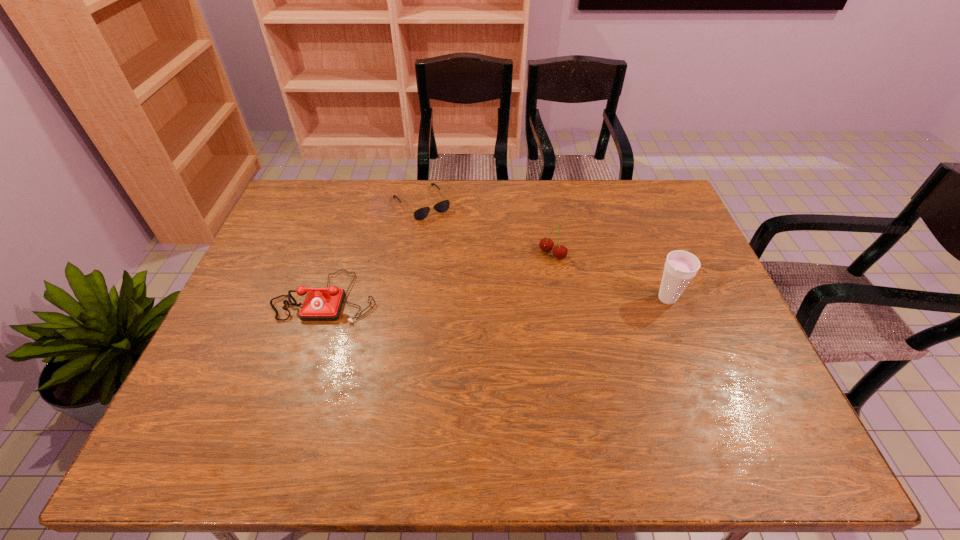
Image resolution: width=960 pixels, height=540 pixels. Identify the location of vacant region located 0.140m on the front-facing side of the shortest object. (456, 244).

The height and width of the screenshot is (540, 960). Identify the location of vacant space located 0.270m on the front-facing side of the shortest object. (476, 269).

The height and width of the screenshot is (540, 960). I want to click on vacant point located 0.230m on the surface of the cherry, so click(x=492, y=302).

Where is `vacant space located on the surface of the cherry`? vacant space located on the surface of the cherry is located at coordinates (468, 321).

Identify the location of vacant area situated 0.150m on the surface of the cherry. The width and height of the screenshot is (960, 540). (511, 287).

You are a GUI agent. You are given a task and a screenshot of the screen. Output one action in this format:
    pyautogui.click(x=<x>, y=<y>)
    Task: Click on the object that is at the far edge
    The width and height of the screenshot is (960, 540).
    Given the screenshot: What is the action you would take?
    pyautogui.click(x=420, y=214)

Locate an element on the screen. object that is positioned at the left edge is located at coordinates (321, 304).

Locate an element on the screen. object that is at the right edge is located at coordinates (680, 267).

Locate an element on the screen. This screenshot has height=540, width=960. free region at the far edge of the desktop is located at coordinates (614, 179).

Locate an element on the screen. Image resolution: width=960 pixels, height=540 pixels. free region at the near edge of the desktop is located at coordinates tap(446, 378).